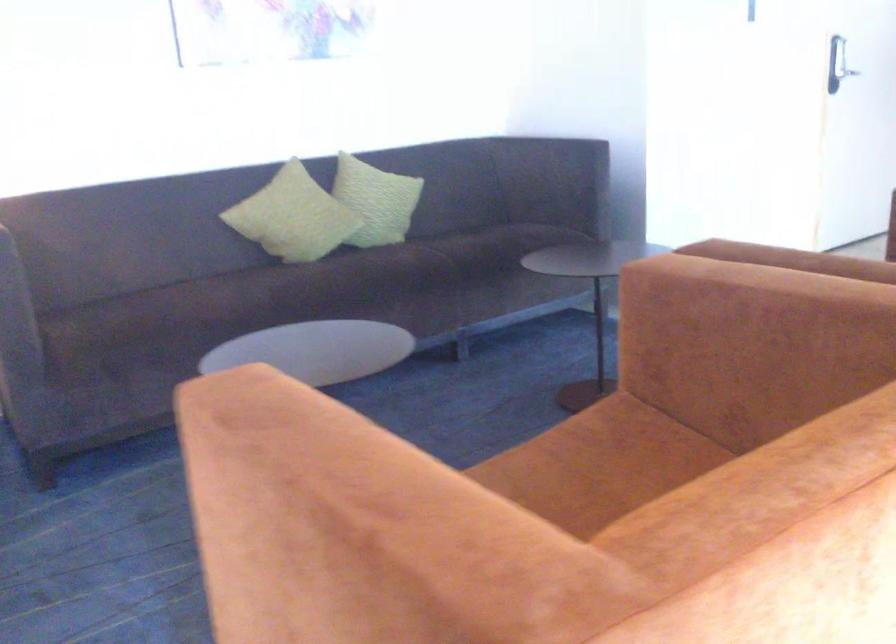
Where would you sit the grey sofa sitting surface? Please return your answer as a coordinate pair (x, y).

(270, 290)